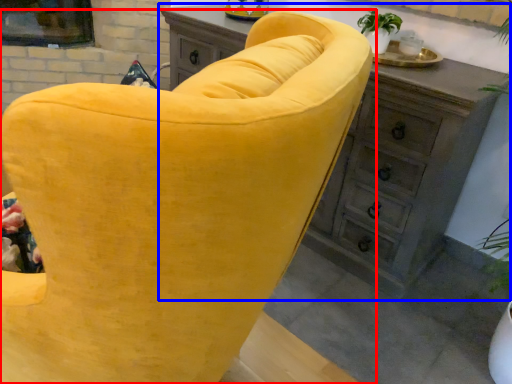
Question: Which object is closer to the camera taking this photo, chair (highlighted by a red box) or chest of drawers (highlighted by a blue box)?

Choices:
 (A) chair
 (B) chest of drawers

Answer: (A)